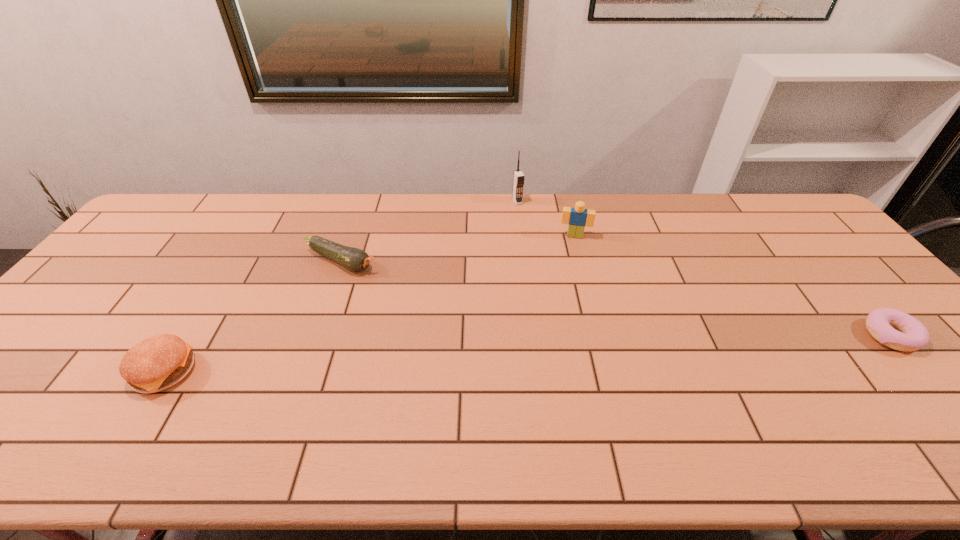
Locate an element on the screen. The height and width of the screenshot is (540, 960). free space located 0.130m on the right of the leftmost object is located at coordinates (249, 372).

What are the coordinates of `free space located on the left of the shortest object` in the screenshot? It's located at (724, 336).

Find the location of a particular element. The width and height of the screenshot is (960, 540). vacant area situated on the front-facing side of the farthest object is located at coordinates (550, 259).

This screenshot has height=540, width=960. In order to click on free space located on the front-facing side of the farthest object in this screenshot , I will do `click(535, 232)`.

Locate an element on the screen. The image size is (960, 540). vacant point located on the front-facing side of the farthest object is located at coordinates (538, 238).

Locate an element on the screen. vacant area situated at the blossom end of the second object from left to right is located at coordinates (403, 285).

Image resolution: width=960 pixels, height=540 pixels. In order to click on vacant space located 0.230m at the blossom end of the second object from left to right in this screenshot , I will do [x=434, y=300].

At what (x,y) coordinates should I click in order to perform the action: click on free spot located 0.310m at the blossom end of the second object from left to right. Please return your answer as a coordinate pair (x, y). This screenshot has height=540, width=960. Looking at the image, I should click on (457, 312).

This screenshot has width=960, height=540. What are the coordinates of `vacant region located on the face of the Lego` in the screenshot? It's located at (566, 310).

Identify the location of free space located on the face of the Lego. (566, 313).